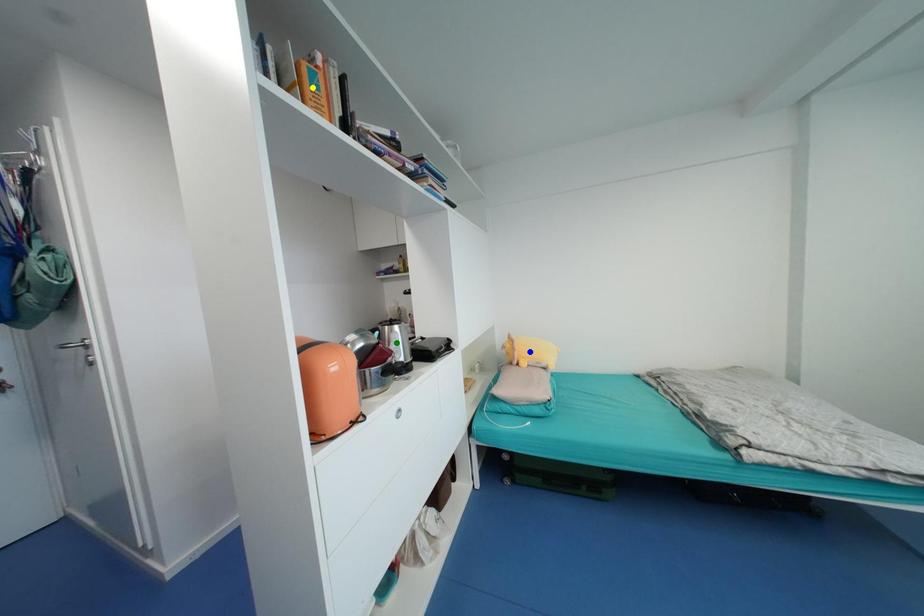
From the picture: Order these from farthest to nearest:
- blue point
- yellow point
- green point

1. blue point
2. green point
3. yellow point